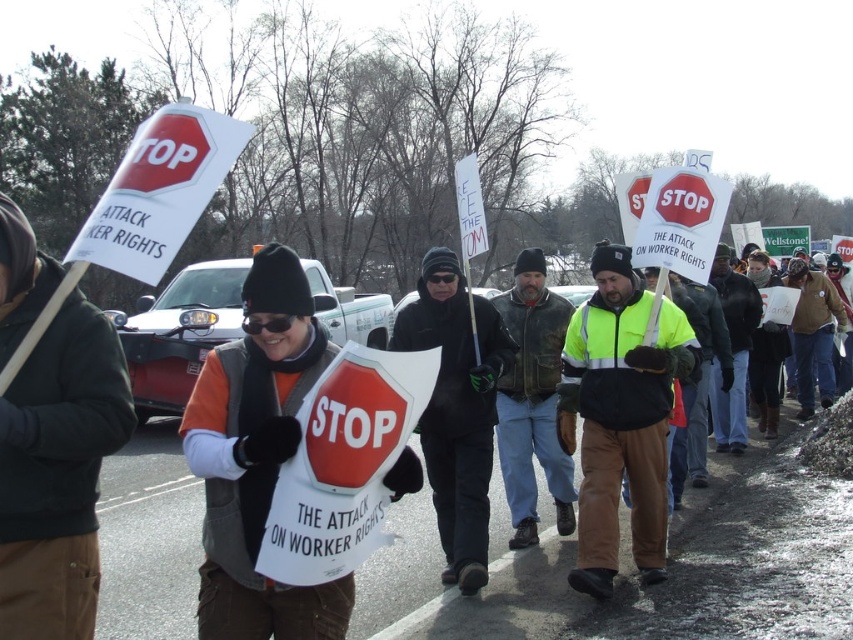
Question: From the image, what is the correct spatial relationship of dark green jacket at left in relation to leather jacket at center?

Choices:
 (A) right
 (B) left

Answer: (B)

Question: Can you confirm if high-visibility yellow jacket at center is positioned to the left of black fabric jacket at center?

Choices:
 (A) no
 (B) yes

Answer: (A)

Question: Which is nearer to the matte black vest at center?

Choices:
 (A) black fabric jacket at center
 (B) high-visibility yellow jacket at center
 (C) dark green jacket at left
 (D) leather jacket at center

Answer: (C)

Question: Which point is closer to the camera taking this photo?

Choices:
 (A) (267, 509)
 (B) (521, 545)
 (C) (30, 529)

Answer: (C)

Question: Can you confirm if matte black vest at center is smaller than black fabric jacket at center?

Choices:
 (A) no
 (B) yes

Answer: (B)

Question: Which point appears farthest from the camera in this image?

Choices:
 (A) (450, 436)
 (B) (534, 408)

Answer: (B)